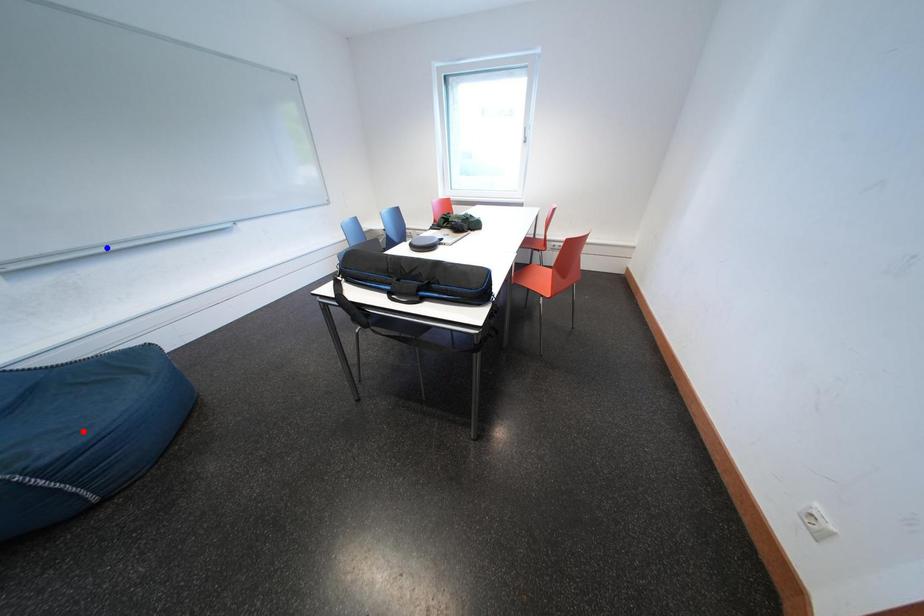
Question: In the image, two points are highlighted. Which point is nearer to the camera? Reply with the corresponding letter.

Choices:
 (A) blue point
 (B) red point

Answer: (B)